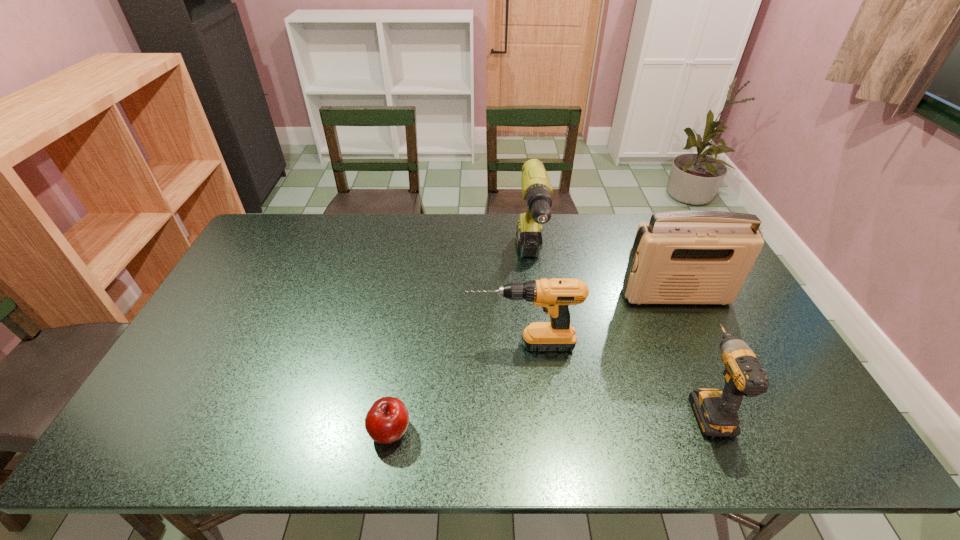
Image resolution: width=960 pixels, height=540 pixels. Find the location of `vacant area situated at the tip of the third nearest object`. vacant area situated at the tip of the third nearest object is located at coordinates (344, 345).

The width and height of the screenshot is (960, 540). I want to click on free space located with the drill bit of the rightmost drill facing forward, so click(672, 326).

Identify the location of free location located with the drill bit of the rightmost drill facing forward. (682, 347).

At what (x,y) coordinates should I click in order to perform the action: click on free region located 0.360m with the drill bit of the rightmost drill facing forward. Please return your answer as a coordinate pair (x, y). This screenshot has height=540, width=960. Looking at the image, I should click on (653, 281).

Where is `free space located 0.310m on the right of the shortest object`? The height and width of the screenshot is (540, 960). free space located 0.310m on the right of the shortest object is located at coordinates pos(544,431).

Identify the location of object that is at the far edge. (536, 188).

Find the location of a particular element. The image size is (960, 540). drill located at the near edge is located at coordinates (716, 411).

The width and height of the screenshot is (960, 540). In order to click on apple at the near edge in this screenshot , I will do `click(387, 420)`.

The width and height of the screenshot is (960, 540). Identify the location of object at the right edge. (679, 257).

The width and height of the screenshot is (960, 540). In the image, there is a desktop. Identify the location of free region at the far edge. (481, 238).